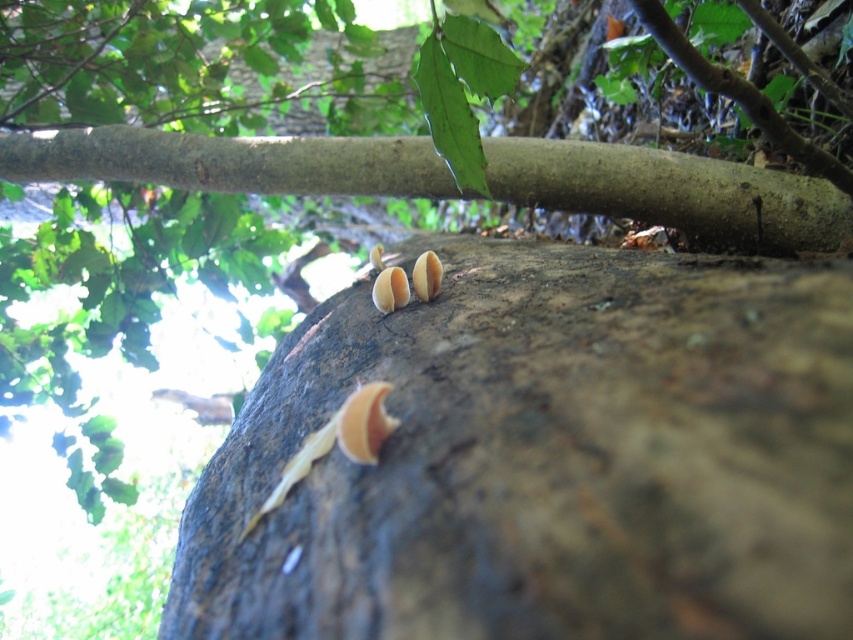
You are an observer looking at the tree trunk. Which object is positioned higher up on the tree trunk between the smooth brown branch at upper center and the smooth beige fungi at center?

The smooth brown branch at upper center is positioned higher up on the tree trunk than the smooth beige fungi at center.

You are a mycologist examining the tree trunk and need to identify the larger fungi. Which one is bigger between the smooth beige fungi at center and the brown matte fungi at center?

The smooth beige fungi at center is bigger than the brown matte fungi at center according to the description.